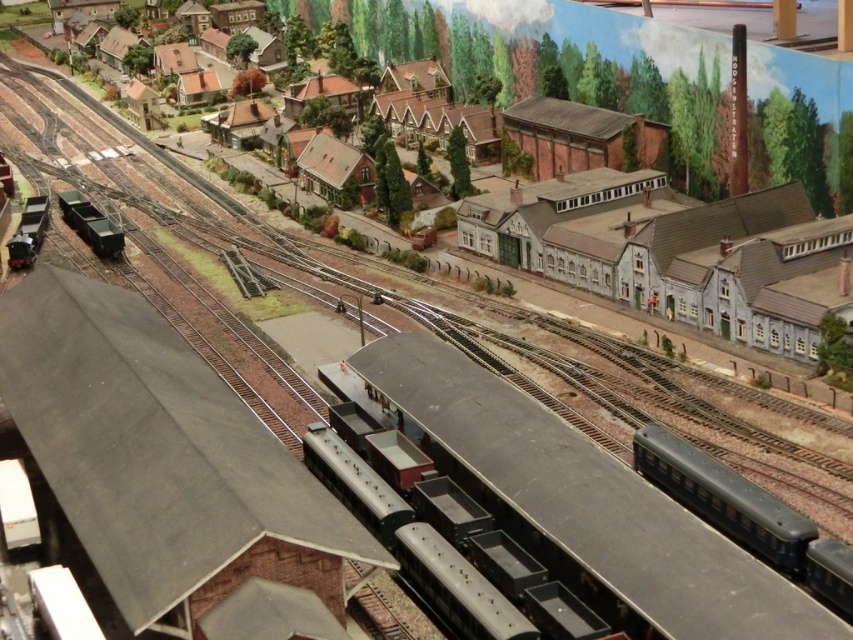
You are a model railway enthusiast who wants to place a new train car between the matte black train at center and the metallic green freight car at left. Given that the new car is 1.2 meters wide, will it fit in the space between them?

The matte black train at center is wider than the metallic green freight car at left. Since the new car is 1.2 meters wide, it might not fit if the space between them is narrower than 1.2 meters. However, the exact width of the space isn

You are a model railway enthusiast examining the diorama. You notice the smooth gray roof at center. Based on its 2D coordinates, can you determine its position relative to the edges of the image?

The smooth gray roof at center is located at coordinates point 0.700 on the x axis and 0.179 on the y axis, meaning it is closer to the right edge and lower part of the image.

You are a model railway enthusiast examining the layout. You notice the metallic green freight car at left and the shiny black train at lower left. Which of these two objects is bigger in size?

The metallic green freight car at left is larger in size than the shiny black train at lower left.